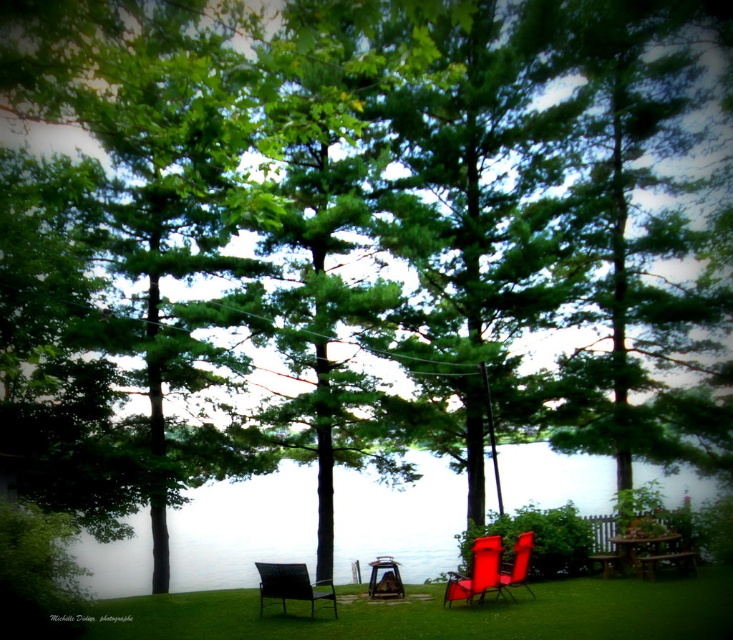
Question: Is transparent water at center positioned in front of metallic silver chair at center?

Choices:
 (A) no
 (B) yes

Answer: (A)

Question: Which object appears farthest from the camera in this image?

Choices:
 (A) transparent water at center
 (B) metallic silver chair at center
 (C) matte red chair at lower right

Answer: (A)

Question: Which object is farther from the camera taking this photo?

Choices:
 (A) green grass at center
 (B) metallic silver chair at lower left

Answer: (B)

Question: Can you confirm if green grass at center is thinner than matte red chair at center?

Choices:
 (A) yes
 (B) no

Answer: (B)

Question: Can you confirm if matte red chair at lower right is thinner than matte red chair at center?

Choices:
 (A) no
 (B) yes

Answer: (B)

Question: Which object is positioned farthest from the transparent water at center?

Choices:
 (A) metallic silver chair at lower left
 (B) green grass at center
 (C) matte red chair at center

Answer: (A)